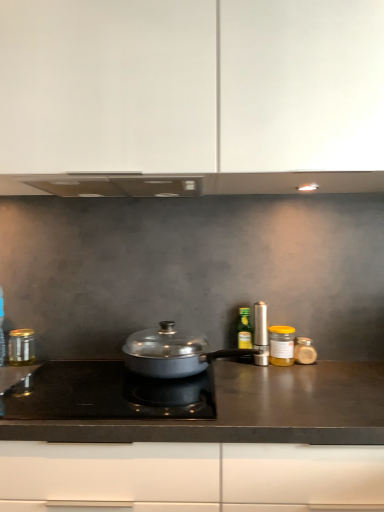
Locate an element on the screen. The image size is (384, 512). free space in front of translucent glass jar at right, acting as the 6th kitchen appliance starting from the left is located at coordinates (319, 376).